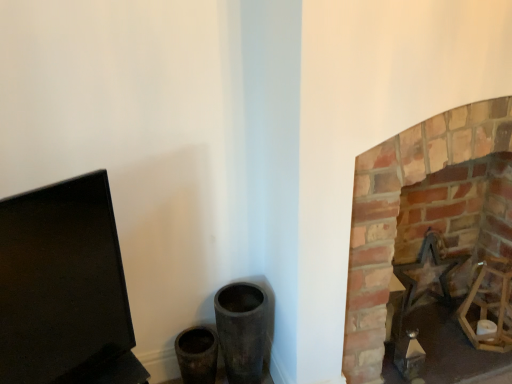
Question: Considering the positions of black matte computer monitor at left and brick fireplace at right in the image, is black matte computer monitor at left taller or shorter than brick fireplace at right?

Choices:
 (A) tall
 (B) short

Answer: (B)

Question: From the image's perspective, is black matte computer monitor at left positioned above or below brick fireplace at right?

Choices:
 (A) below
 (B) above

Answer: (A)

Question: Based on their relative distances, which object is nearer to the metallic star at right?

Choices:
 (A) brick fireplace at right
 (B) black matte computer monitor at left

Answer: (A)

Question: Which is nearer to the brick fireplace at right?

Choices:
 (A) metallic star at right
 (B) black matte computer monitor at left

Answer: (A)